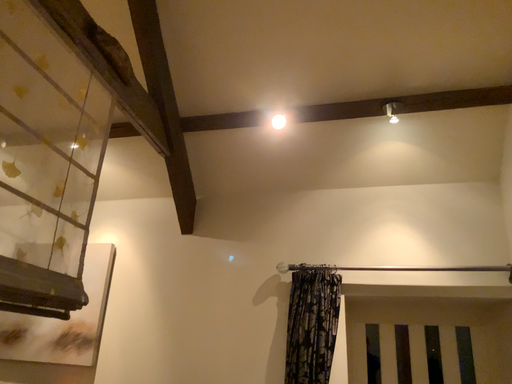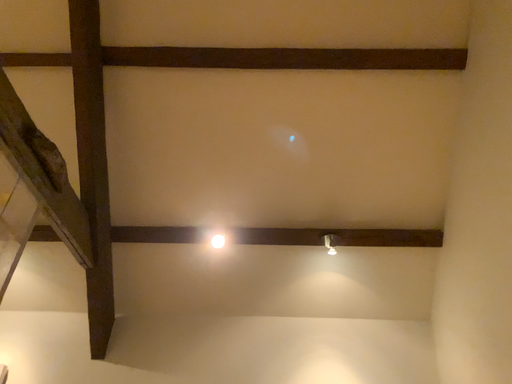
Question: How did the camera likely rotate when shooting the video?

Choices:
 (A) rotated downward
 (B) rotated upward

Answer: (B)